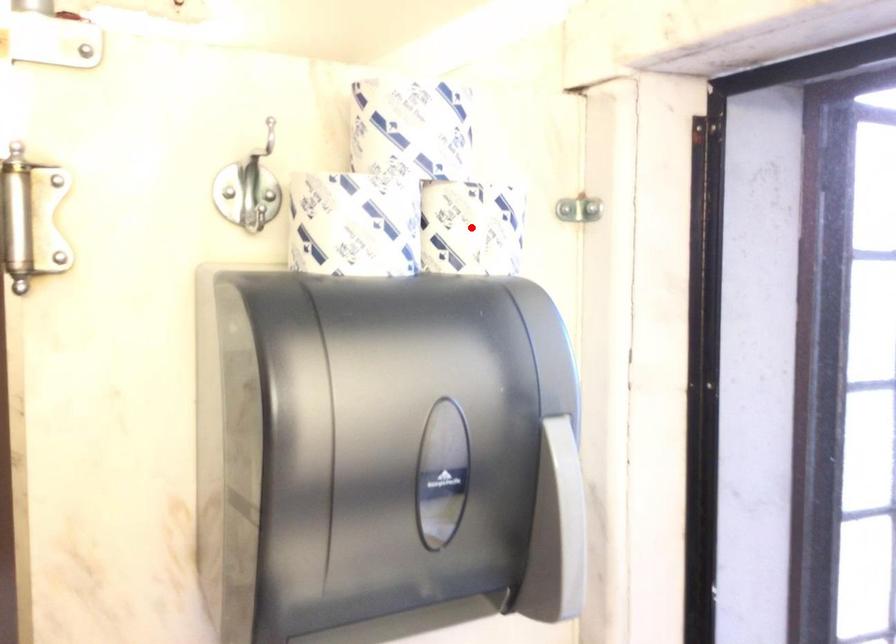
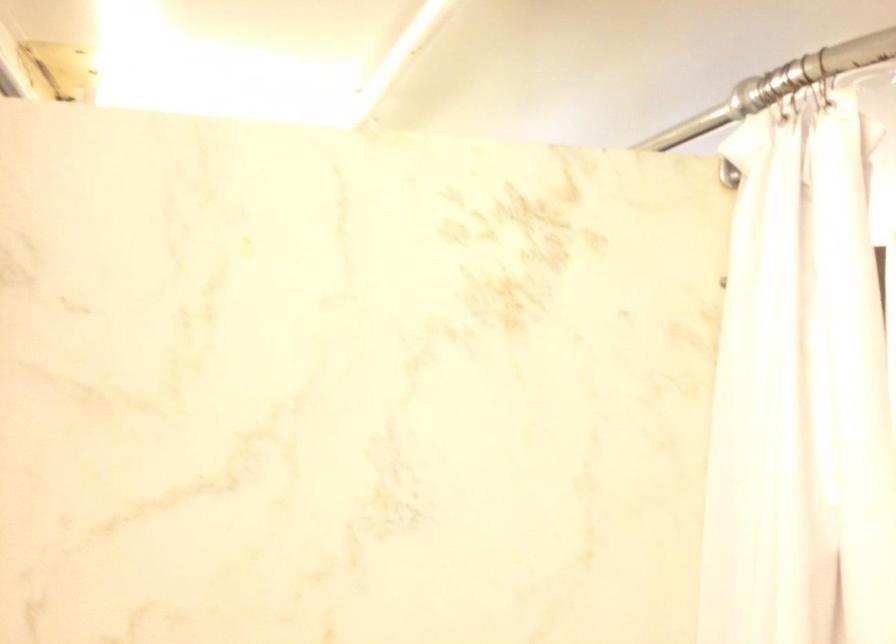
Question: I am providing you with two images of the same scene from different viewpoints. A red point is marked on the first image. Can you still see the location of the red point in image 2?

Choices:
 (A) Yes
 (B) No

Answer: (B)